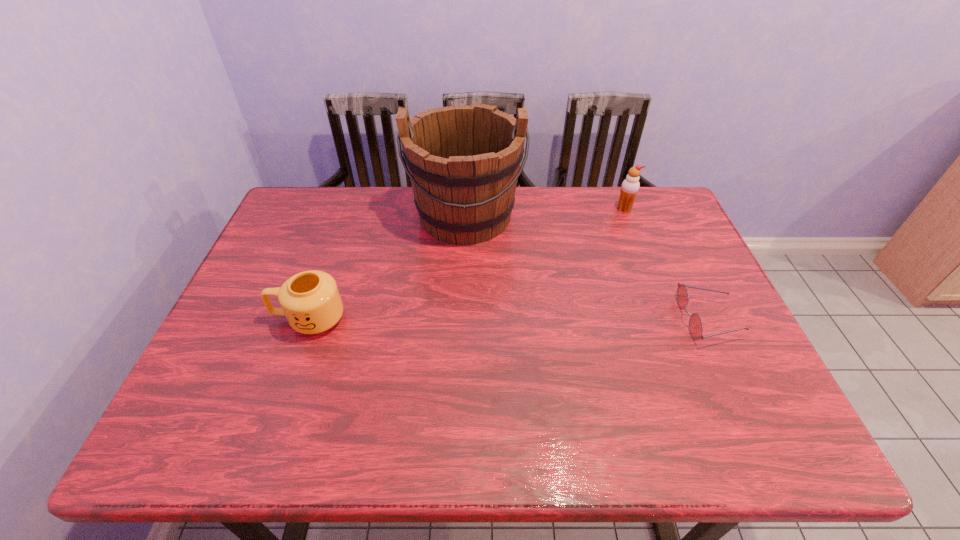
The image size is (960, 540). Find the location of `icecream at the right edge`. icecream at the right edge is located at coordinates (630, 186).

The width and height of the screenshot is (960, 540). I want to click on object at the far right corner, so click(630, 186).

Where is `vacant space at the far edge of the desktop`? The width and height of the screenshot is (960, 540). vacant space at the far edge of the desktop is located at coordinates (371, 212).

This screenshot has width=960, height=540. In the image, there is a desktop. Find the location of `blank space at the near edge`. blank space at the near edge is located at coordinates (588, 379).

The height and width of the screenshot is (540, 960). Find the location of `vacant region at the left edge`. vacant region at the left edge is located at coordinates (224, 330).

In the image, there is a desktop. Where is `blank space at the right edge`? This screenshot has width=960, height=540. blank space at the right edge is located at coordinates (727, 307).

Where is `vacant space at the near left corner`? Image resolution: width=960 pixels, height=540 pixels. vacant space at the near left corner is located at coordinates (195, 385).

Find the location of a particular element. The height and width of the screenshot is (540, 960). free space that is in between the tallest object and the rightmost object is located at coordinates (587, 268).

The image size is (960, 540). Identify the location of free space that is in between the second tallest object and the spectacles. (665, 265).

Find the location of `vacant point located between the third object from left to right and the third object from right to left`. vacant point located between the third object from left to right and the third object from right to left is located at coordinates (545, 212).